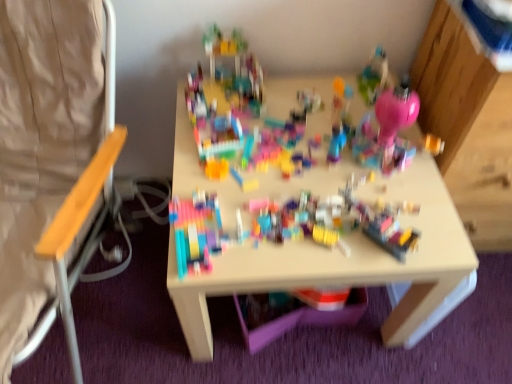
Where is `vacant area on top of multicolored plastic blocks at center, which is the 2th toy from bottom to top (from a real-world perspective)`? vacant area on top of multicolored plastic blocks at center, which is the 2th toy from bottom to top (from a real-world perspective) is located at coordinates (301, 157).